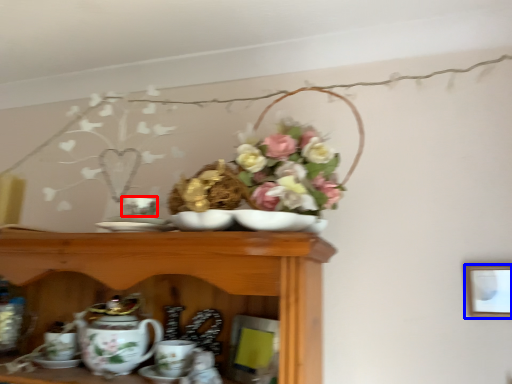
Question: Which of the following is the closest to the observer, tableware (highlighted by a red box) or picture frame (highlighted by a blue box)?

Choices:
 (A) tableware
 (B) picture frame

Answer: (A)